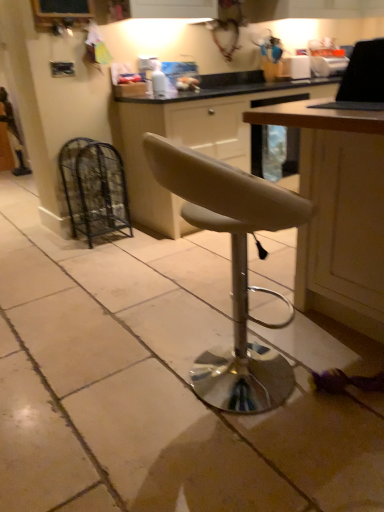
Where is `black wire mesh cage at left`? The width and height of the screenshot is (384, 512). black wire mesh cage at left is located at coordinates (94, 188).

What is the approximate width of beige leather stool at center?

19.25 inches.

Locate an element on the screen. black glossy laptop at upper right is located at coordinates click(x=362, y=79).

Locate an element on the screen. This screenshot has height=512, width=384. matte beige cabinet at center is located at coordinates (193, 139).

Is black wire mesh cage at left facing towards black glossy laptop at upper right?

Yes.

From a real-world perspective, is black wire mesh cage at left physically above black glossy laptop at upper right?

No, from a real-world perspective, black wire mesh cage at left is not above black glossy laptop at upper right.

Considering the relative positions of black wire mesh cage at left and black glossy laptop at upper right in the image provided, is black wire mesh cage at left to the left of black glossy laptop at upper right from the viewer's perspective?

Yes.

Who is shorter, matte beige cabinet at center or black glossy laptop at upper right?

black glossy laptop at upper right is shorter.

From a real-world perspective, does matte beige cabinet at center sit lower than black glossy laptop at upper right?

Indeed, from a real-world perspective, matte beige cabinet at center is positioned beneath black glossy laptop at upper right.

Considering the sizes of objects beige leather stool at center and black glossy laptop at upper right in the image provided, who is thinner, beige leather stool at center or black glossy laptop at upper right?

Thinner between the two is black glossy laptop at upper right.

In the image, is beige leather stool at center positioned in front of or behind black glossy laptop at upper right?

In the image, beige leather stool at center appears in front of black glossy laptop at upper right.

Between beige leather stool at center and black glossy laptop at upper right, which one appears on the right side from the viewer's perspective?

black glossy laptop at upper right.

Is beige leather stool at center positioned far away from black glossy laptop at upper right?

No, beige leather stool at center is in close proximity to black glossy laptop at upper right.

From a real-world perspective, is beige leather stool at center positioned above or below matte beige cabinet at center?

beige leather stool at center is below matte beige cabinet at center.

Is beige leather stool at center next to matte beige cabinet at center and touching it?

No, beige leather stool at center is not next to matte beige cabinet at center.

Considering the relative positions of beige leather stool at center and matte beige cabinet at center in the image provided, is beige leather stool at center to the left or to the right of matte beige cabinet at center?

beige leather stool at center is positioned on matte beige cabinet at center's left side.

Can you tell me how much beige leather stool at center and matte beige cabinet at center differ in facing direction?

The facing directions of beige leather stool at center and matte beige cabinet at center are 83.9 degrees apart.

Can you confirm if beige leather stool at center is wider than wooden table at right?

In fact, beige leather stool at center might be narrower than wooden table at right.

Is beige leather stool at center shorter than wooden table at right?

Indeed, beige leather stool at center has a lesser height compared to wooden table at right.

Where is `chair below the wooden table at right (from a real-world perspective)`? The height and width of the screenshot is (512, 384). chair below the wooden table at right (from a real-world perspective) is located at coordinates (232, 268).

From the image's perspective, relative to black glossy laptop at upper right, is wooden table at right above or below?

Based on their image positions, wooden table at right is located beneath black glossy laptop at upper right.

In the scene shown: Is wooden table at right positioned beyond the bounds of black glossy laptop at upper right?

Indeed, wooden table at right is completely outside black glossy laptop at upper right.

Is wooden table at right not close to black glossy laptop at upper right?

No, wooden table at right is in close proximity to black glossy laptop at upper right.

How different are the orientations of wooden table at right and black glossy laptop at upper right in degrees?

They differ by 0.863 degrees in their facing directions.

The image size is (384, 512). I want to click on appliance below the black glossy laptop at upper right (from the image's perspective), so click(x=94, y=188).

Does black glossy laptop at upper right have a lesser height compared to black wire mesh cage at left?

Correct, black glossy laptop at upper right is not as tall as black wire mesh cage at left.

Is black glossy laptop at upper right positioned with its back to black wire mesh cage at left?

No, black glossy laptop at upper right is not facing away from black wire mesh cage at left.

Who is smaller, black glossy laptop at upper right or black wire mesh cage at left?

black glossy laptop at upper right.

Identify the location of laptop on the right of black wire mesh cage at left. This screenshot has width=384, height=512. (362, 79).

Where is `laptop in front of the matte beige cabinet at center`? laptop in front of the matte beige cabinet at center is located at coordinates (362, 79).

Which object lies nearer to the anchor point matte beige cabinet at center, black glossy laptop at upper right or black wire mesh cage at left?

black wire mesh cage at left.

Considering their positions, is beige leather stool at center positioned further to black wire mesh cage at left than wooden table at right?

The object further to black wire mesh cage at left is wooden table at right.

Based on their spatial positions, is wooden table at right or matte beige cabinet at center further from black wire mesh cage at left?

Based on the image, wooden table at right appears to be further to black wire mesh cage at left.

When comparing their distances from matte beige cabinet at center, does black glossy laptop at upper right or beige leather stool at center seem closer?

Based on the image, beige leather stool at center appears to be nearer to matte beige cabinet at center.

From the image, which object appears to be nearer to wooden table at right, black glossy laptop at upper right or beige leather stool at center?

black glossy laptop at upper right lies closer to wooden table at right than the other object.

Considering their positions, is wooden table at right positioned further to black glossy laptop at upper right than black wire mesh cage at left?

black wire mesh cage at left.

Considering their positions, is matte beige cabinet at center positioned closer to wooden table at right than black glossy laptop at upper right?

The object closer to wooden table at right is black glossy laptop at upper right.

Considering their positions, is wooden table at right positioned further to black wire mesh cage at left than black glossy laptop at upper right?

The object further to black wire mesh cage at left is black glossy laptop at upper right.

Where is `laptop positioned between wooden table at right and matte beige cabinet at center from near to far`? This screenshot has width=384, height=512. laptop positioned between wooden table at right and matte beige cabinet at center from near to far is located at coordinates (362, 79).

You are a GUI agent. You are given a task and a screenshot of the screen. Output one action in this format:
    pyautogui.click(x=<x>, y=<y>)
    Task: Click on the laptop between beige leather stool at center and black wire mesh cage at left in the front-back direction
    The width and height of the screenshot is (384, 512).
    Given the screenshot: What is the action you would take?
    pyautogui.click(x=362, y=79)

You are a GUI agent. You are given a task and a screenshot of the screen. Output one action in this format:
    pyautogui.click(x=<x>, y=<y>)
    Task: Click on the cabinetry between beige leather stool at center and black wire mesh cage at left from front to back
    This screenshot has width=384, height=512.
    Given the screenshot: What is the action you would take?
    pyautogui.click(x=193, y=139)

The width and height of the screenshot is (384, 512). I want to click on table located between beige leather stool at center and matte beige cabinet at center in the depth direction, so click(338, 212).